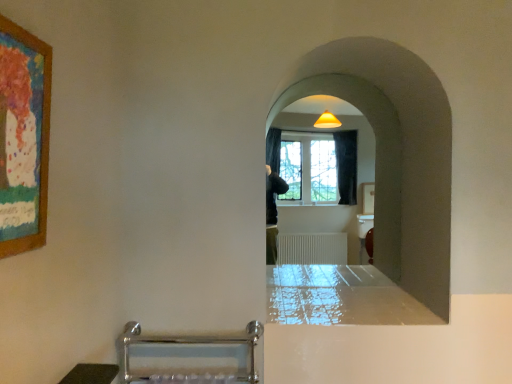
Find the location of a particular element. The image size is (512, 384). vacant space underneath white matte wall at center (from a real-world perspective) is located at coordinates tap(357, 301).